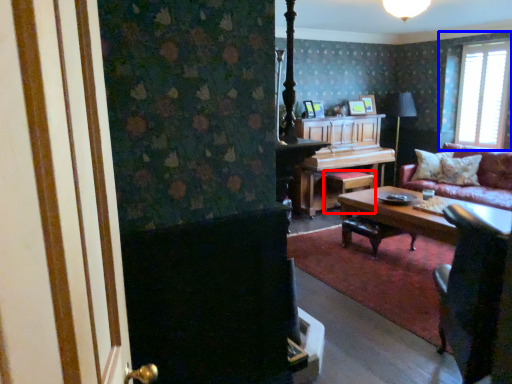
Question: Which point is further to the camera, stool (highlighted by a red box) or window (highlighted by a blue box)?

Choices:
 (A) stool
 (B) window

Answer: (A)